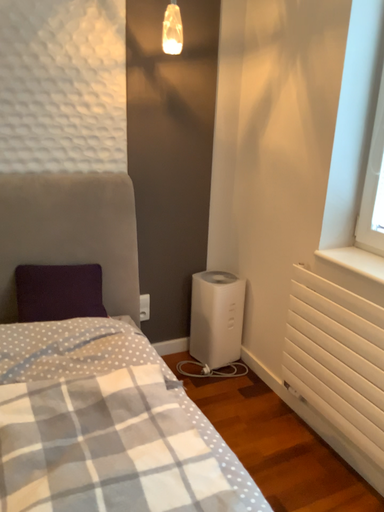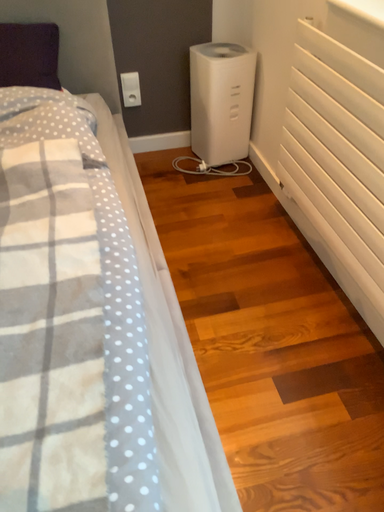
Question: How did the camera likely rotate when shooting the video?

Choices:
 (A) rotated right
 (B) rotated left

Answer: (B)